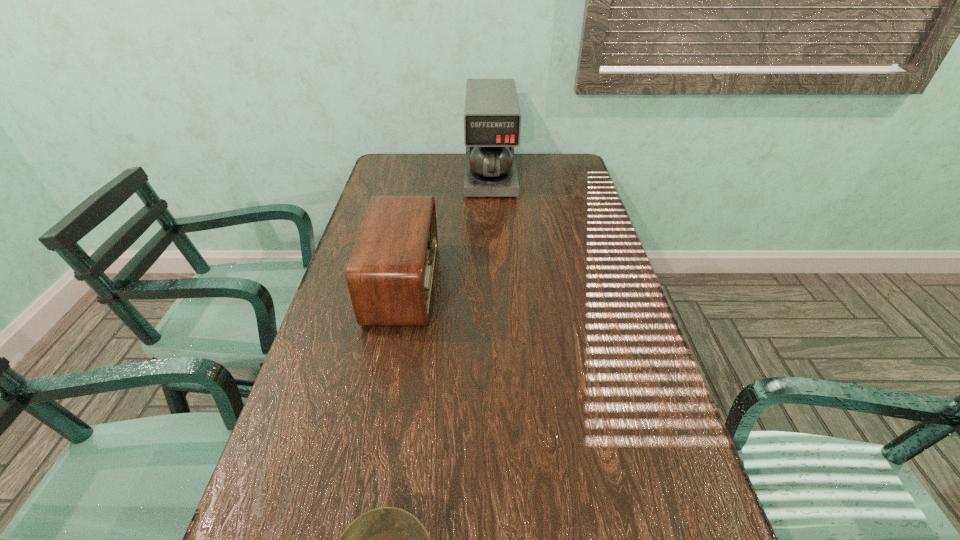
What are the coordinates of `the farthest object` in the screenshot? It's located at (492, 119).

Identify the location of the tallest object. The height and width of the screenshot is (540, 960). (492, 119).

At what (x,y) coordinates should I click in order to perform the action: click on radio receiver. Please return your answer as a coordinate pair (x, y). This screenshot has height=540, width=960. Looking at the image, I should click on (390, 274).

Identify the location of the second shortest object. (390, 274).

At what (x,y) coordinates should I click in order to perform the action: click on free space located 0.210m on the carafe side of the rightmost object. Please return your answer as a coordinate pair (x, y). The width and height of the screenshot is (960, 540). Looking at the image, I should click on (492, 234).

You are a GUI agent. You are given a task and a screenshot of the screen. Output one action in this format:
    pyautogui.click(x=<x>, y=<y>)
    Task: Click on the vacant area located on the front panel of the radio receiver
    The width and height of the screenshot is (960, 540).
    Given the screenshot: What is the action you would take?
    pyautogui.click(x=535, y=283)

What are the coordinates of `object located at the far edge` in the screenshot? It's located at (492, 119).

Where is `object that is at the left edge`? The height and width of the screenshot is (540, 960). object that is at the left edge is located at coordinates pos(390,274).

This screenshot has width=960, height=540. In order to click on free region at the far edge of the desktop in this screenshot , I will do `click(540, 176)`.

Identify the location of vacant space at the left edge. (368, 201).